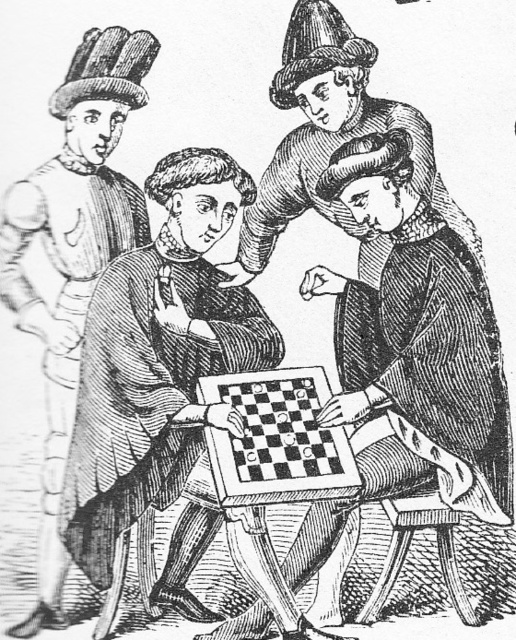
Between point (68, 128) and point (288, 499), which one is positioned in front?

Point (288, 499)

Who is taller, smooth leather hat at left or black wood chessboard at center?

smooth leather hat at left

The width and height of the screenshot is (516, 640). What do you see at coordinates (72, 253) in the screenshot?
I see `smooth leather hat at left` at bounding box center [72, 253].

You are a GUI agent. You are given a task and a screenshot of the screen. Output one action in this format:
    pyautogui.click(x=<x>, y=<y>)
    Task: Click on the smooth leather hat at left
    The height and width of the screenshot is (640, 516).
    Given the screenshot: What is the action you would take?
    click(x=72, y=253)

Is smooth brown robe at center to the left of smooth leather hat at left from the viewer's perspective?

No, smooth brown robe at center is not to the left of smooth leather hat at left.

Which is below, smooth brown robe at center or smooth leather hat at left?

smooth brown robe at center is lower down.

Image resolution: width=516 pixels, height=640 pixels. I want to click on smooth brown robe at center, so click(413, 317).

Where is `smooth brown robe at center`? The image size is (516, 640). smooth brown robe at center is located at coordinates (413, 317).

Does smooth brown robe at center have a lesser width compared to black wood chessboard at center?

No.

Between smooth brown robe at center and black wood chessboard at center, which one has less height?

With less height is black wood chessboard at center.

Identify the location of smooth brown robe at center. The width and height of the screenshot is (516, 640). click(x=413, y=317).

Identify the location of smooth brown robe at center. This screenshot has height=640, width=516. (413, 317).